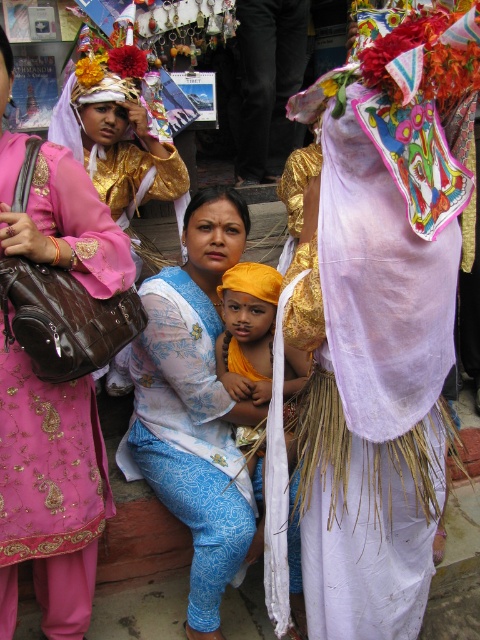
You are an event planner organizing a photo shoot in this scene. You need to decide which object, the white sheer cloth at center or the matte pink dress at left, would be better to use as a backdrop for a portrait. Based on their sizes, which would you choose and why?

The white sheer cloth at center is larger in size than the matte pink dress at left, so it would be better to use the white sheer cloth at center as a backdrop since it can cover a wider area and provide a more visually cohesive background for the portrait.